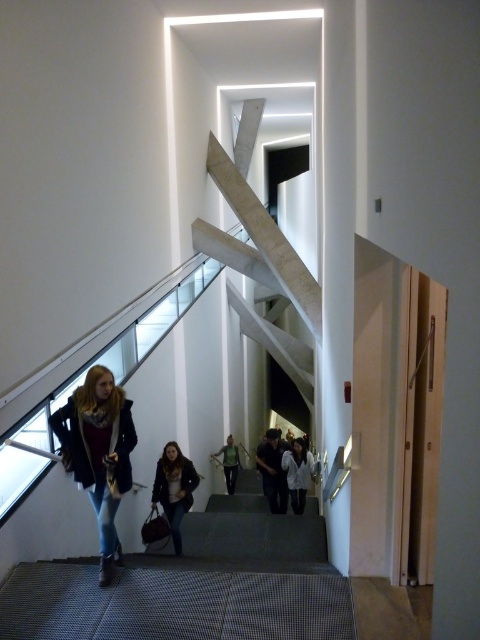
Question: Which object appears closest to the camera in this image?

Choices:
 (A) matte black coat at lower left
 (B) white cotton hoodie at center
 (C) green fabric shirt at center

Answer: (A)

Question: Does white cotton hoodie at center appear on the left side of green fabric shirt at center?

Choices:
 (A) yes
 (B) no

Answer: (B)

Question: Does denim jacket at center have a larger size compared to dark gray fabric jacket at center?

Choices:
 (A) yes
 (B) no

Answer: (B)

Question: Which of the following is the closest to the observer?

Choices:
 (A) (129, 467)
 (B) (180, 461)

Answer: (A)

Question: Which point is farther from the camera taking this photo?

Choices:
 (A) (288, 470)
 (B) (98, 468)

Answer: (A)

Question: Is dark gray fabric jacket at center to the left of green fabric shirt at center from the viewer's perspective?

Choices:
 (A) no
 (B) yes

Answer: (A)